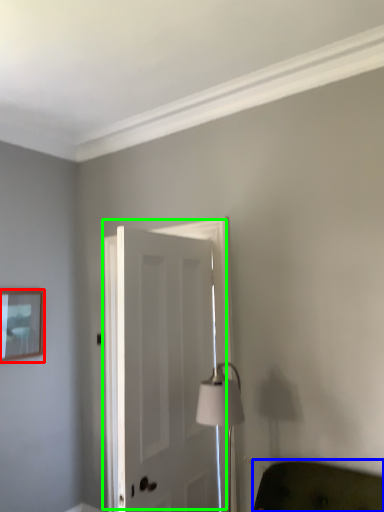
Question: Based on their relative distances, which object is nearer to picture frame (highlighted by a red box)? Choose from furniture (highlighted by a blue box) and door (highlighted by a green box).

Choices:
 (A) furniture
 (B) door

Answer: (B)